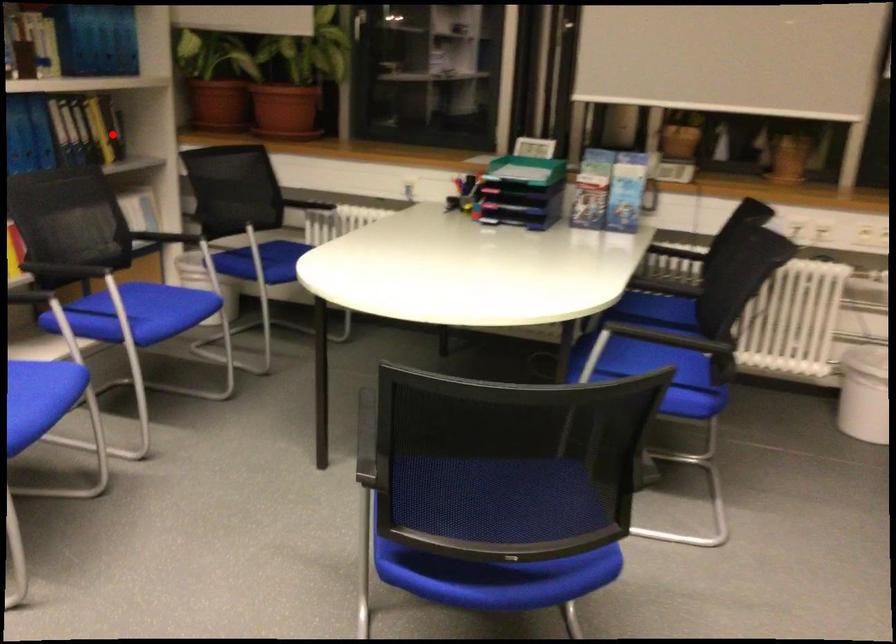
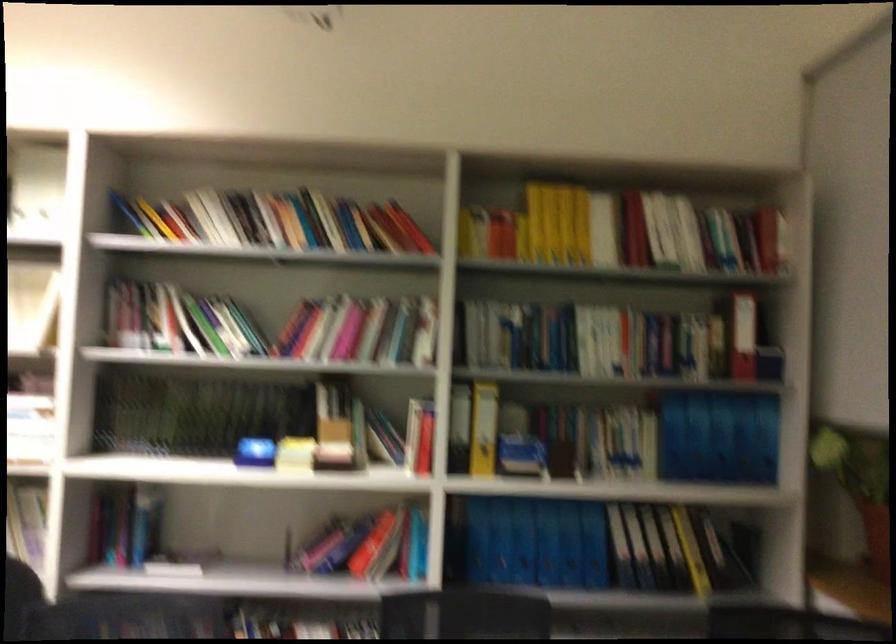
Where in the second image is the point corresponding to the highlighted location from the first image?

(716, 554)